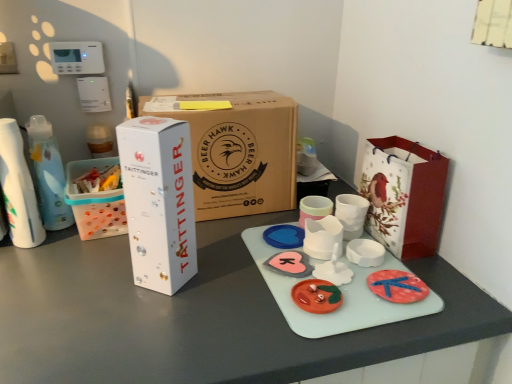
At what (x,y) coordinates should I click in order to perform the action: click on free space in front of matte plastic toy at center, acting as the 1th toy starting from the front. Please return your answer as a coordinate pair (x, y). This screenshot has width=512, height=384. Looking at the image, I should click on (314, 337).